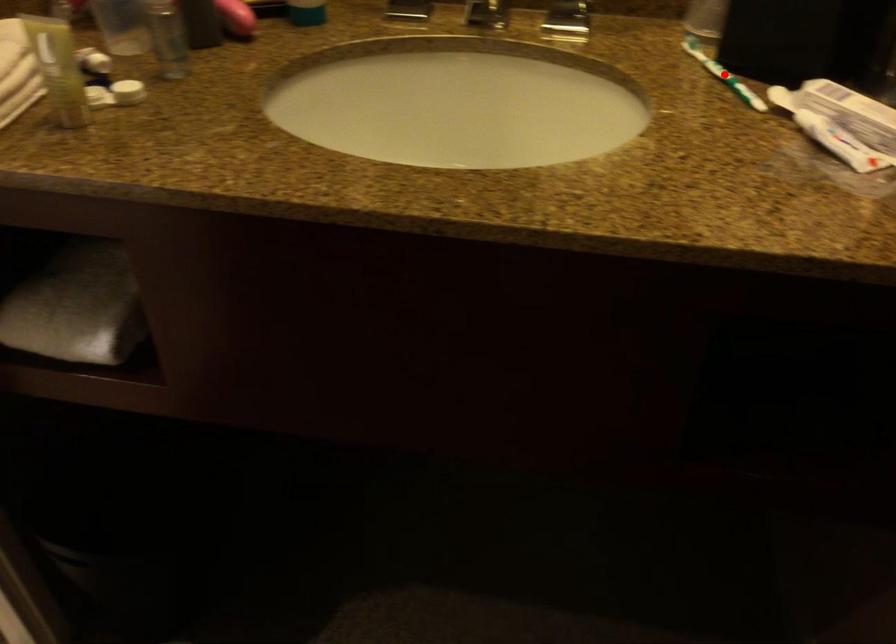
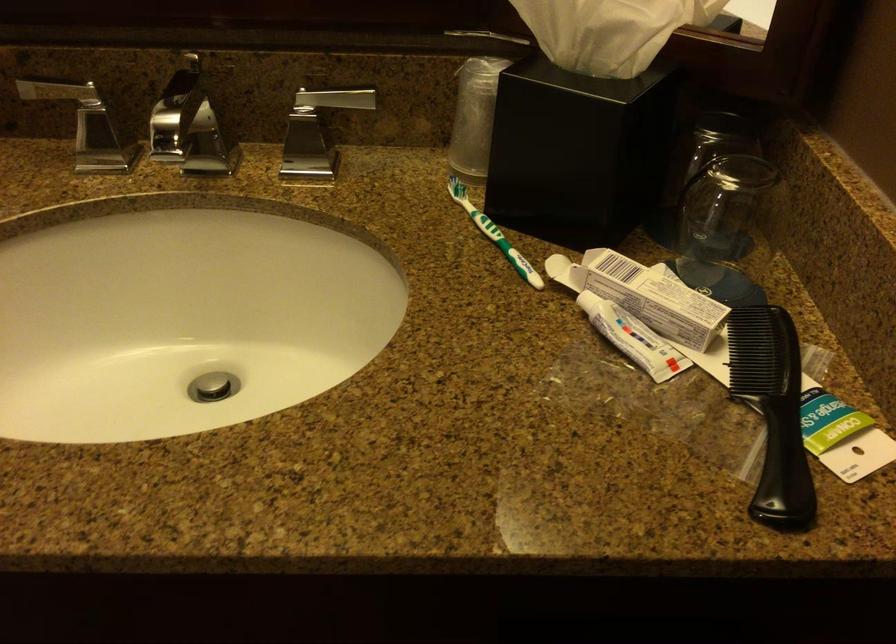
Find the pixel in the second image that matches the highlighted location in the first image.

(494, 234)